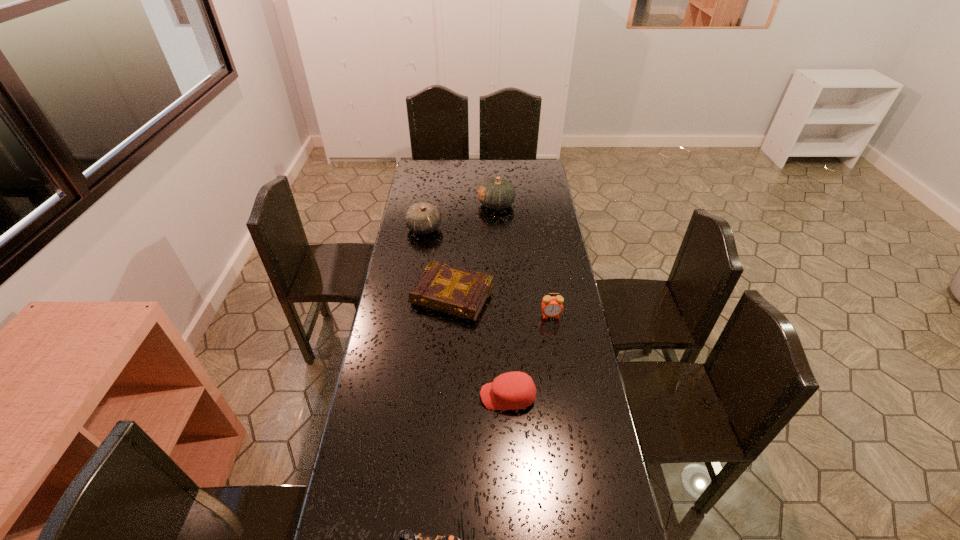
This screenshot has height=540, width=960. I want to click on blank area located 0.150m on the face of the rightmost object, so click(557, 352).

Where is `free space located on the front-facing side of the second nearest object`? The width and height of the screenshot is (960, 540). free space located on the front-facing side of the second nearest object is located at coordinates (439, 396).

Find the location of a particular element. This screenshot has width=960, height=540. free space located 0.250m on the front-facing side of the second nearest object is located at coordinates (401, 396).

Image resolution: width=960 pixels, height=540 pixels. Find the location of `vacant space located 0.120m on the front-facing side of the second nearest object`. vacant space located 0.120m on the front-facing side of the second nearest object is located at coordinates (443, 396).

Locate an element on the screen. This screenshot has height=540, width=960. vacant area situated on the right of the hardback book is located at coordinates (532, 296).

What are the coordinates of `gourd present at the left edge` in the screenshot? It's located at (422, 218).

Identify the location of hardback book that is positioned at the left edge. The height and width of the screenshot is (540, 960). (456, 291).

The image size is (960, 540). I want to click on object located in the right edge section of the desktop, so click(551, 306).

You are a GUI agent. You are given a task and a screenshot of the screen. Output one action in this format:
    pyautogui.click(x=<x>, y=<y>)
    Task: Click on the free region at the far edge
    
    Given the screenshot: What is the action you would take?
    pyautogui.click(x=464, y=159)

The height and width of the screenshot is (540, 960). In the image, there is a desktop. What are the coordinates of `vacant region at the left edge` in the screenshot? It's located at (405, 252).